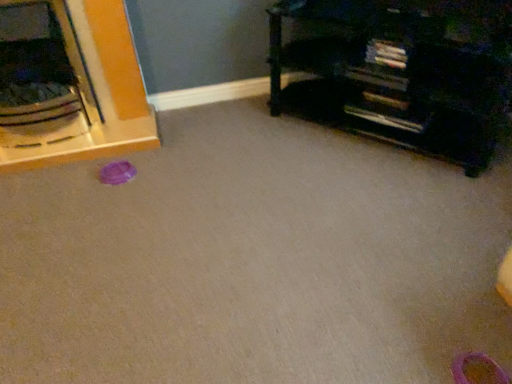
Question: Is black matte bookshelf at upper right, the 1th furniture positioned from the right, inside or outside of pink rubber shoe at lower right?

Choices:
 (A) inside
 (B) outside

Answer: (B)

Question: Considering the positions of point (350, 97) and point (458, 357), is point (350, 97) closer or farther from the camera than point (458, 357)?

Choices:
 (A) closer
 (B) farther

Answer: (B)

Question: Which is nearer to the brushed metal bowl at left, which appears as the first furniture when viewed from the left?

Choices:
 (A) pink rubber shoe at lower right
 (B) black matte bookshelf at upper right, the 1th furniture positioned from the right

Answer: (B)

Question: Which object is the closest to the black matte bookshelf at upper right, the 2th furniture when ordered from left to right?

Choices:
 (A) brushed metal bowl at left, the second furniture viewed from the right
 (B) pink rubber shoe at lower right

Answer: (A)